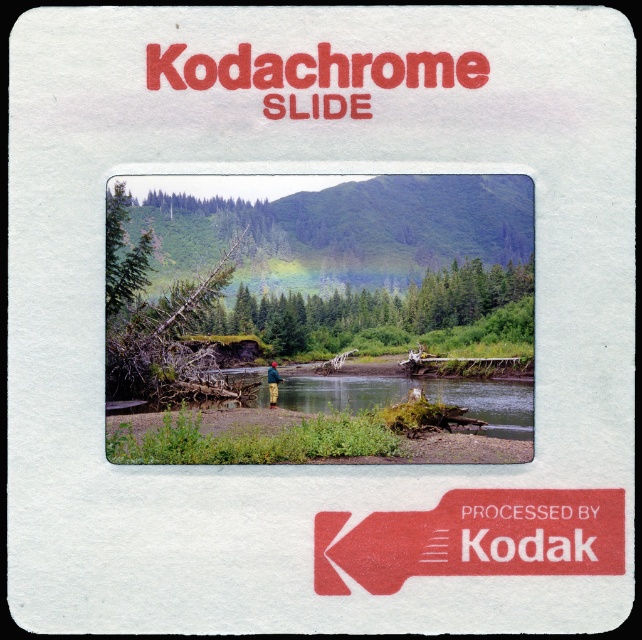
Which is more to the right, green grassy river at center or green woolen hat at center?

green grassy river at center is more to the right.

Looking at this image, can you confirm if green grassy river at center is positioned to the left of green woolen hat at center?

In fact, green grassy river at center is to the right of green woolen hat at center.

This screenshot has height=640, width=642. Describe the element at coordinates (406, 394) in the screenshot. I see `green grassy river at center` at that location.

Identify the location of green grassy river at center. This screenshot has width=642, height=640. (406, 394).